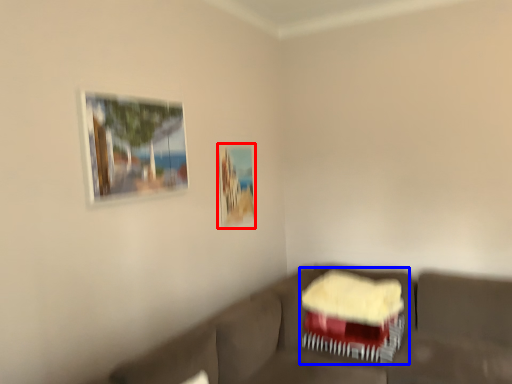
Question: Which point is further to the camera, picture frame (highlighted by a red box) or swivel chair (highlighted by a blue box)?

Choices:
 (A) picture frame
 (B) swivel chair

Answer: (A)